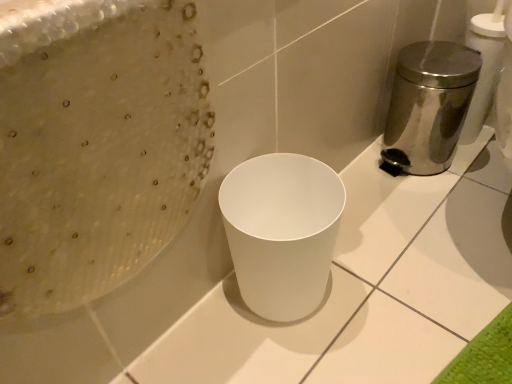
This screenshot has width=512, height=384. Identify the location of vacant area located to the right-hand side of white matte waste container at center. (386, 287).